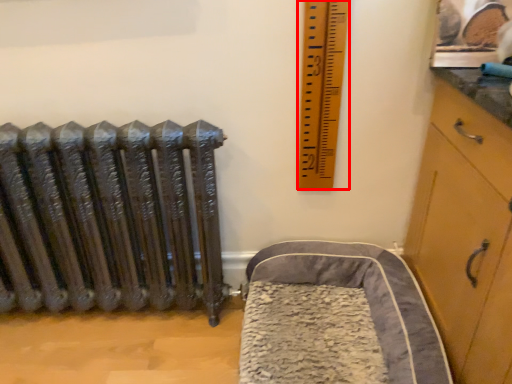
Question: From the image's perspective, where is ruler (annotated by the red box) located relative to furniture?

Choices:
 (A) above
 (B) below

Answer: (A)